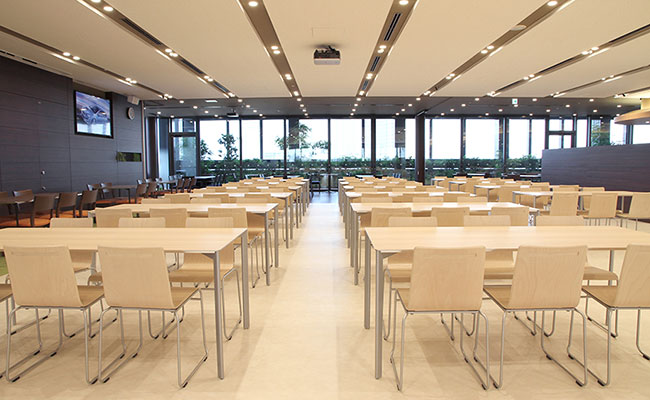
This screenshot has height=400, width=650. I want to click on track lighting, so click(97, 69), click(160, 42), click(268, 38), click(385, 36), click(498, 38), click(561, 64), click(590, 79).